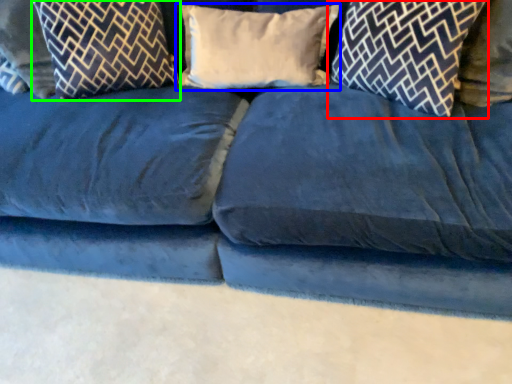
Question: Which object is the closest to the pillow (highlighted by a red box)? Choose among these: pillow (highlighted by a blue box) or pillow (highlighted by a green box).

Choices:
 (A) pillow
 (B) pillow

Answer: (A)